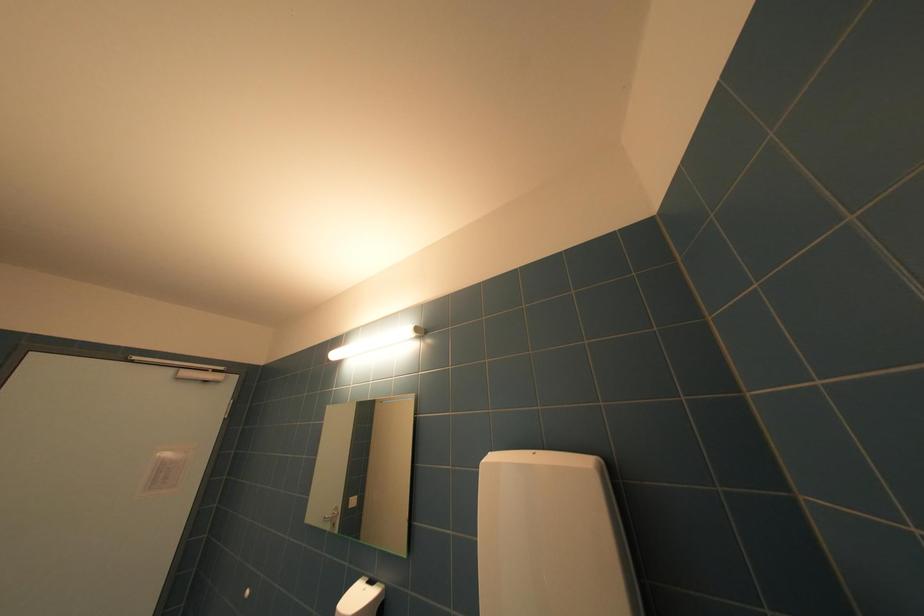
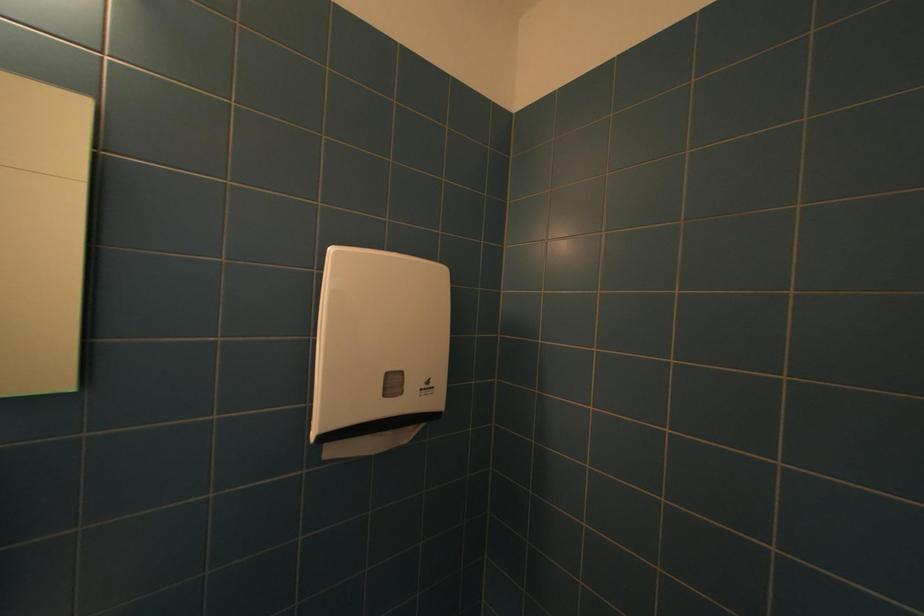
Question: The images are taken continuously from a first-person perspective. In which direction is your viewpoint rotating?

Choices:
 (A) Left
 (B) Right
 (C) Up
 (D) Down

Answer: (B)